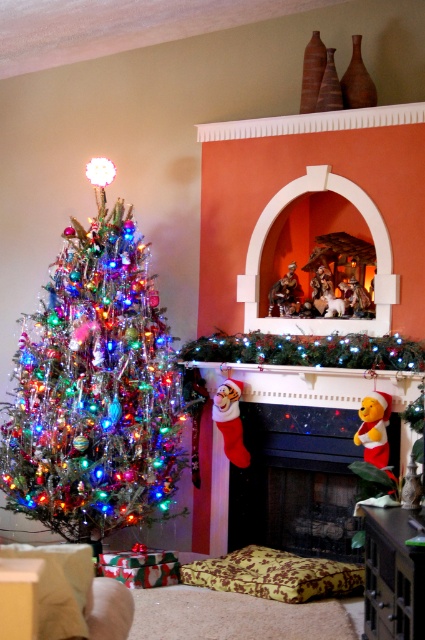
You are a guest in the living room and want to place a small gift under the shiny metallic tree at left. However, there is a velvet winnie the pooh at lower right in the way. Can you place the gift directly under the tree without moving the Winnie the Pooh?

The shiny metallic tree at left is positioned over velvet winnie the pooh at lower right, meaning the tree is above the Winnie the Pooh figurine. Since the gift needs to be placed under the tree, you can place it directly there without moving the Winnie the Pooh because the tree is elevated above it, allowing space underneath.

You are standing in the living room and want to place a new decoration. You have two points marked for hanging it. The first point is at coordinate point(x=144, y=317) and the second is at point(x=397, y=419). Which point is closer to you?

Point(x=144, y=317) is behind point(x=397, y=419), so the point(x=397, y=419) is closer to you.

You are planning to place a new ornament on the mantel. The velvet winnie the pooh at lower right is currently there. Can you fit the shiny metallic tree at left on the mantel without removing the existing ornament?

The shiny metallic tree at left is larger in size than velvet winnie the pooh at lower right. Therefore, if the velvet winnie the pooh at lower right currently fits on the mantel, the shiny metallic tree at left may not fit due to its larger size unless there is sufficient space available.